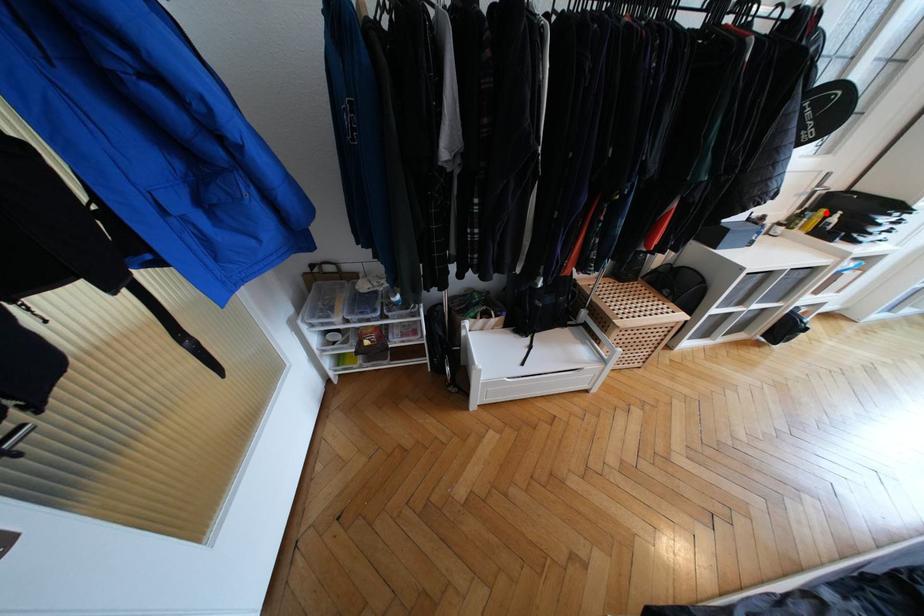
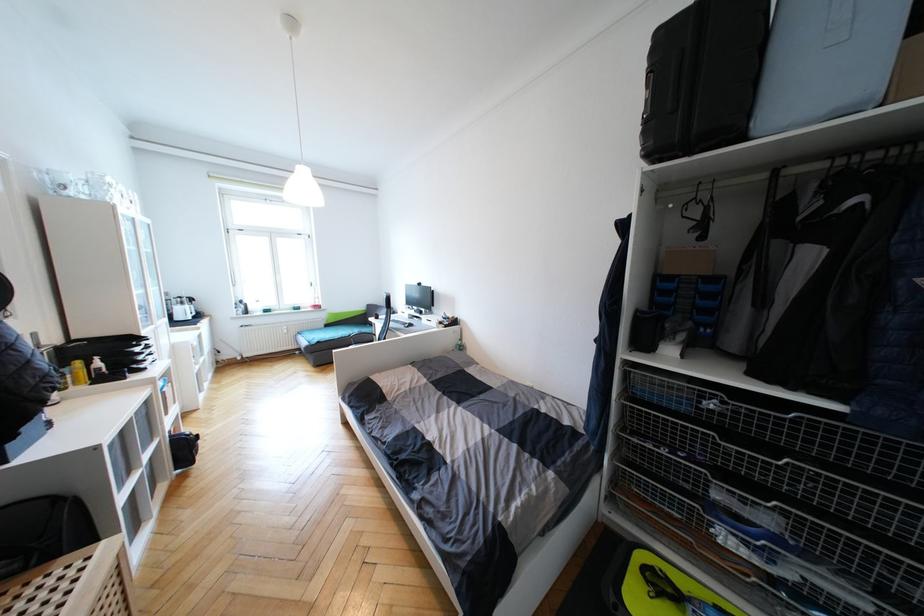
Find the pixel in the second image that matches the highlighted location in the first image.

(81, 363)